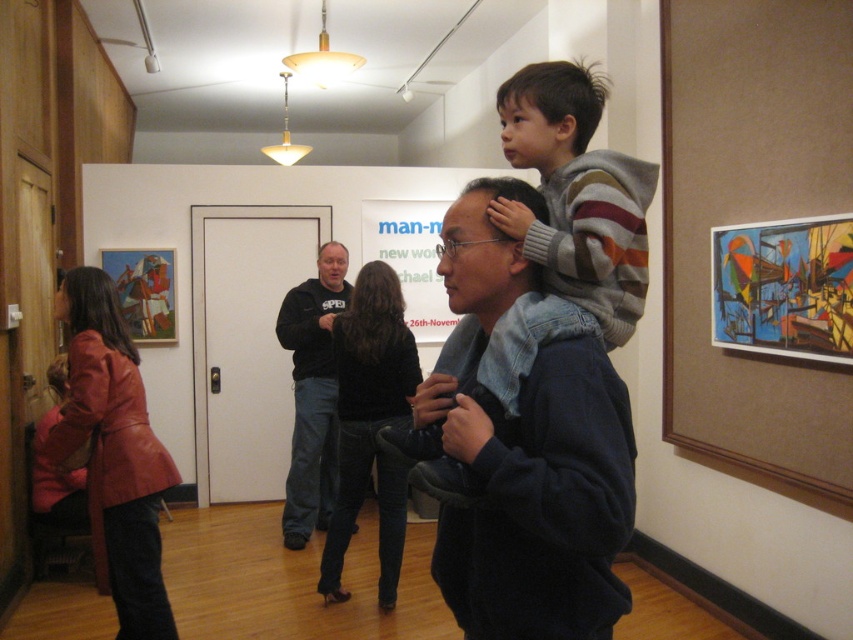
Does leather jacket at lower left have a lesser height compared to black soft jacket at center?

Yes, leather jacket at lower left is shorter than black soft jacket at center.

Image resolution: width=853 pixels, height=640 pixels. What do you see at coordinates (114, 452) in the screenshot?
I see `leather jacket at lower left` at bounding box center [114, 452].

Identify the location of leather jacket at lower left. click(114, 452).

Can you confirm if striped sweater at center is positioned to the left of black soft jacket at center?

In fact, striped sweater at center is to the right of black soft jacket at center.

Is point (628, 205) behind point (332, 420)?

That is False.

I want to click on striped sweater at center, so click(560, 232).

Is leather jacket at lower left to the left of black leather jacket at center from the viewer's perspective?

Yes, leather jacket at lower left is to the left of black leather jacket at center.

Does leather jacket at lower left have a lesser width compared to black leather jacket at center?

No, leather jacket at lower left is not thinner than black leather jacket at center.

Is point (160, 556) positioned in front of point (345, 547)?

Yes, point (160, 556) is closer to viewer.

Locate an element on the screen. leather jacket at lower left is located at coordinates (114, 452).